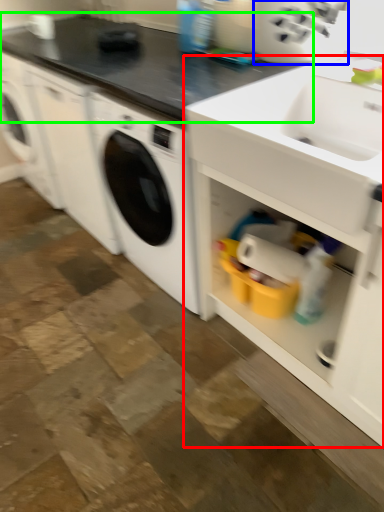
Question: Estimate the real-world distances between objects in this image. Which object is farther from cabinetry (highlighted by a red box), appliance (highlighted by a blue box) or countertop (highlighted by a green box)?

Choices:
 (A) appliance
 (B) countertop

Answer: (B)